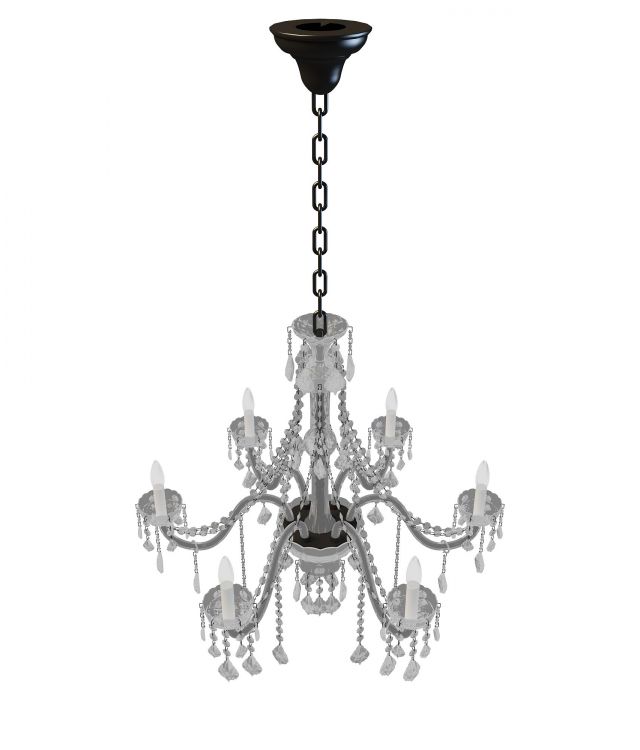
Locate an element on the screen. This screenshot has height=750, width=640. top of chandelier is located at coordinates (337, 331).